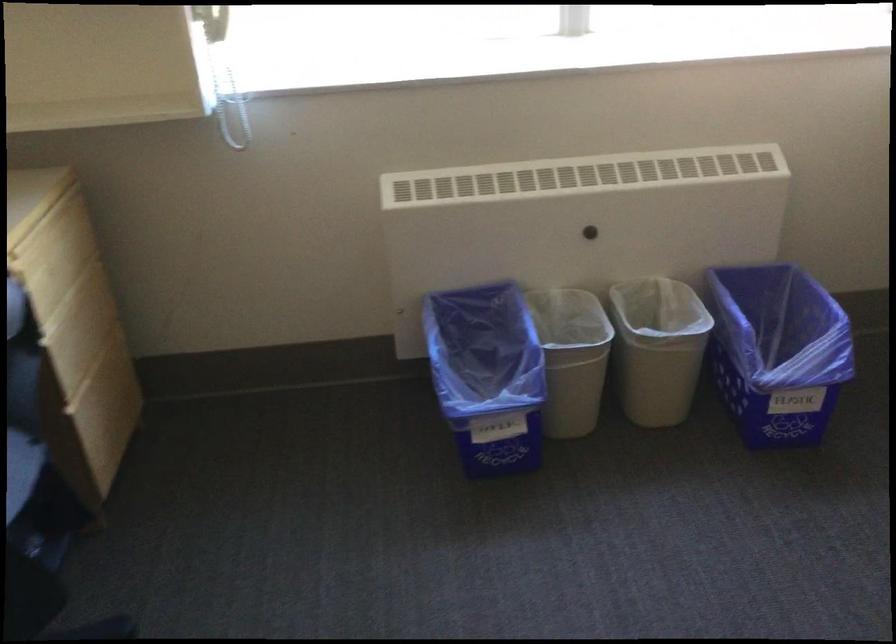
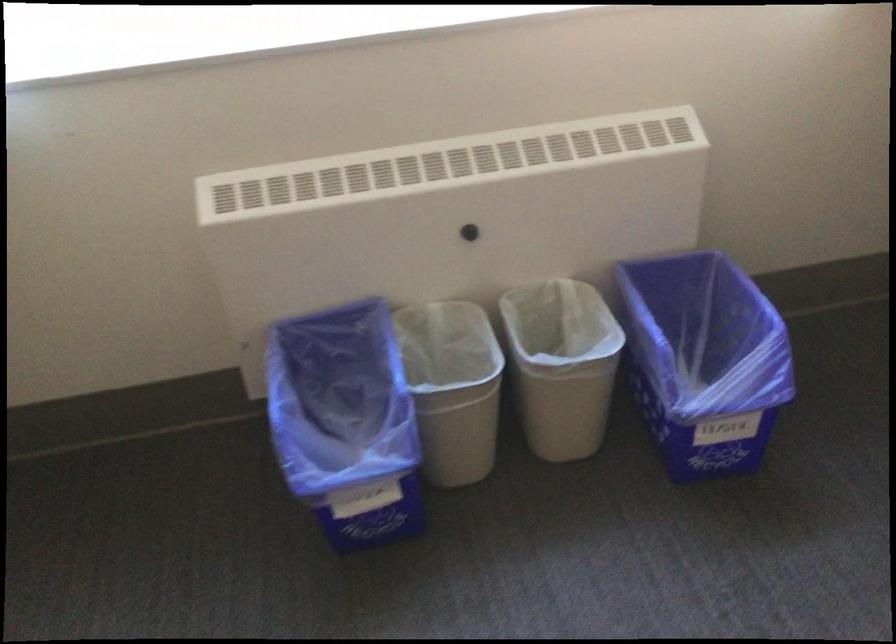
Find the pixel in the second image that matches point (571, 346) in the first image.

(452, 386)